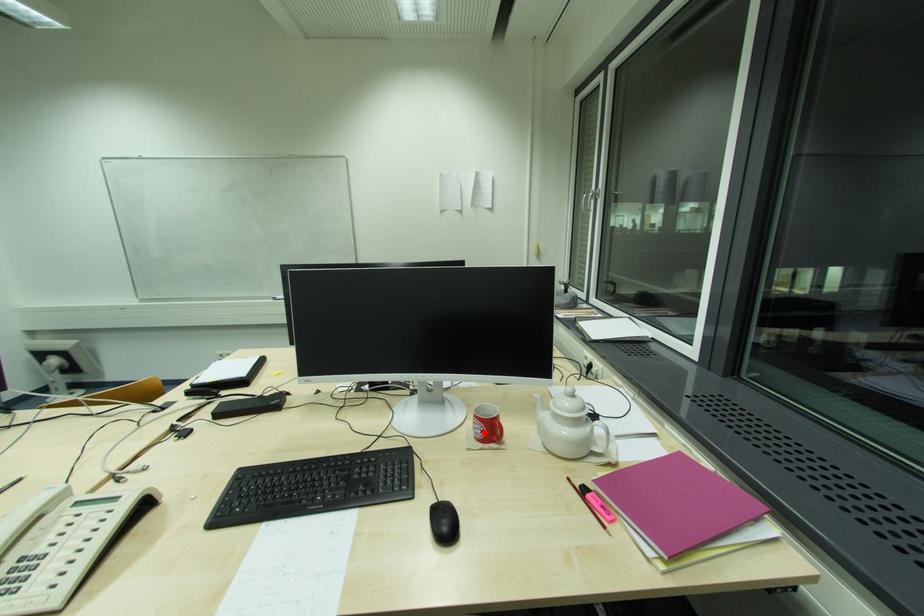
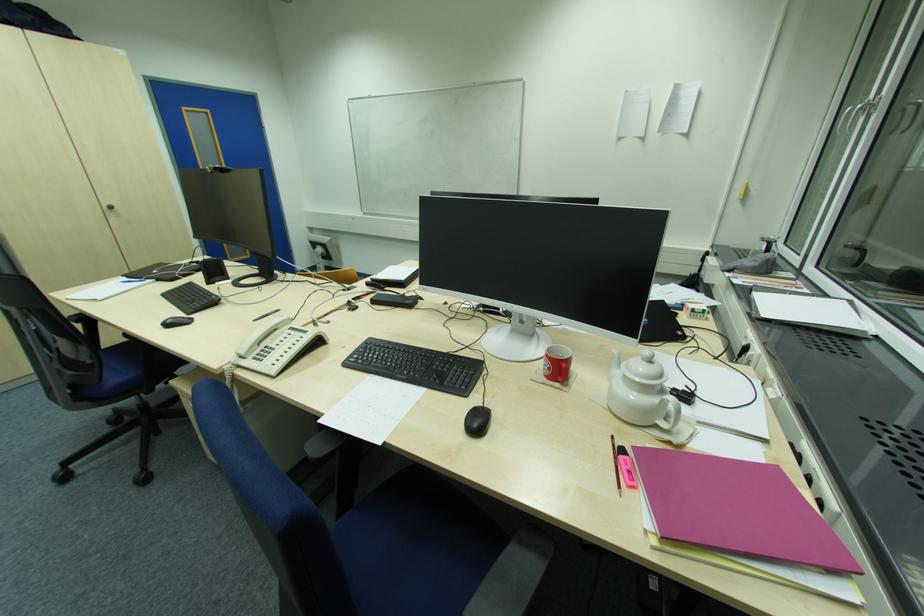
Find the pixel in the second image that matches the highlighted location in the first image.

(551, 370)